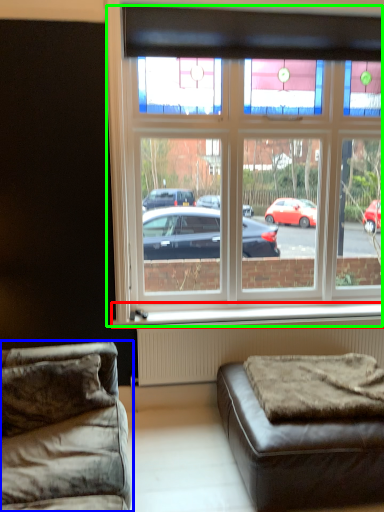
Question: Estimate the real-world distances between objects in this image. Which object is farther from window sill (highlighted by a red box), studio couch (highlighted by a blue box) or window (highlighted by a green box)?

Choices:
 (A) studio couch
 (B) window

Answer: (B)